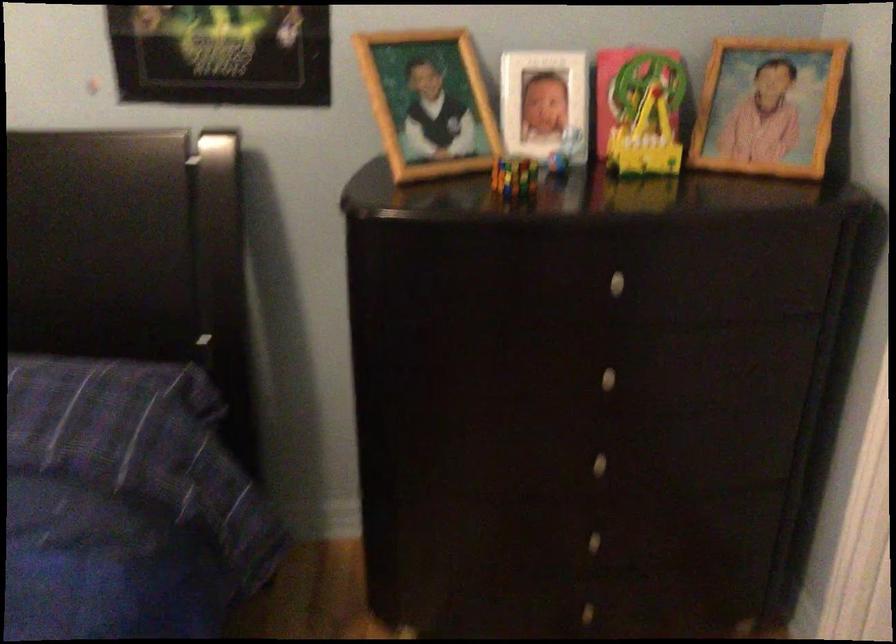
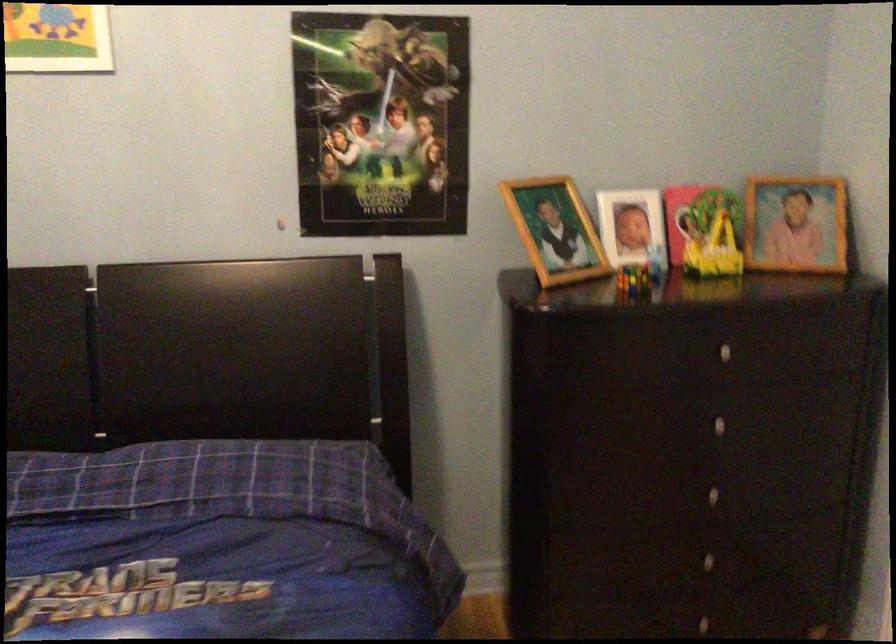
In the second image, find the point that corresponds to [431,109] in the first image.

(555, 230)